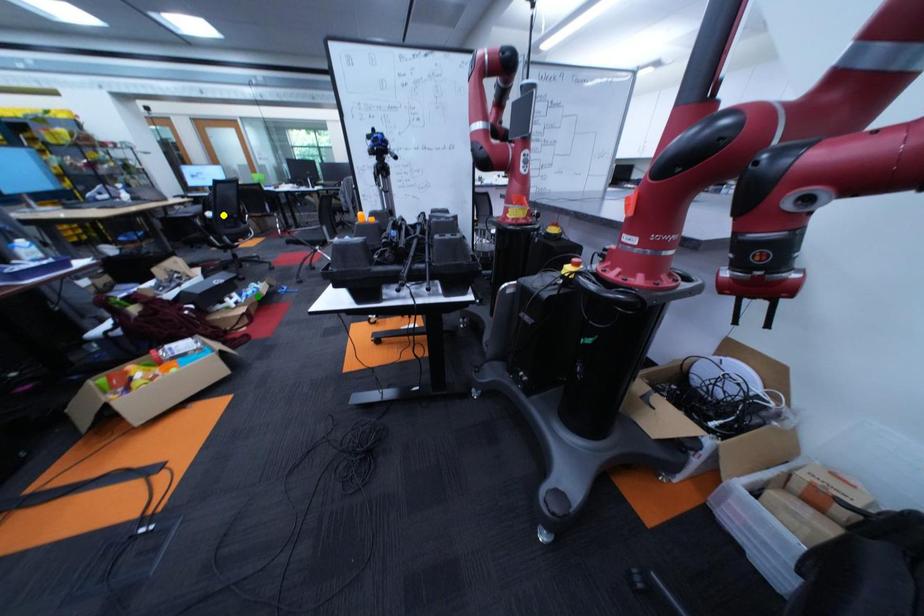
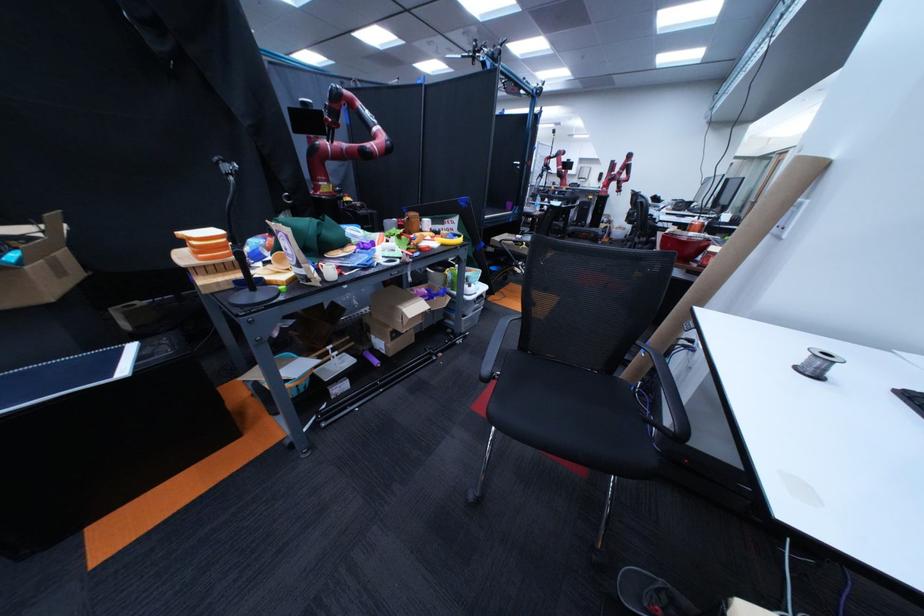
I am providing you with two images of the same scene from different viewpoints. Three points are marked in image1. Which point corresponds to a part or object that is occluded in image2?In image1, three points are marked. Which of them correspond to a part or object that is occluded in image2?Among the three points shown in image1, which one corresponds to a part or object that is no longer visible due to occlusion in image2?

blue point, green point, yellow point